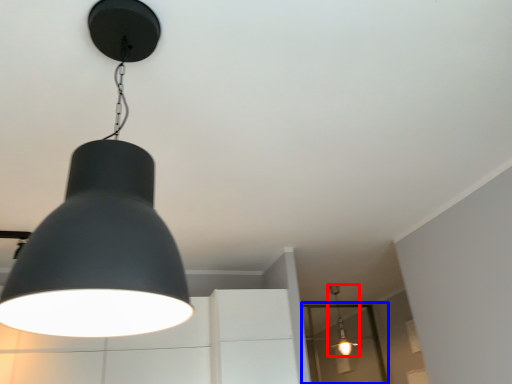
Question: Which of the following is the closest to the observer, lamp (highlighted by a red box) or glass door (highlighted by a blue box)?

Choices:
 (A) lamp
 (B) glass door

Answer: (A)